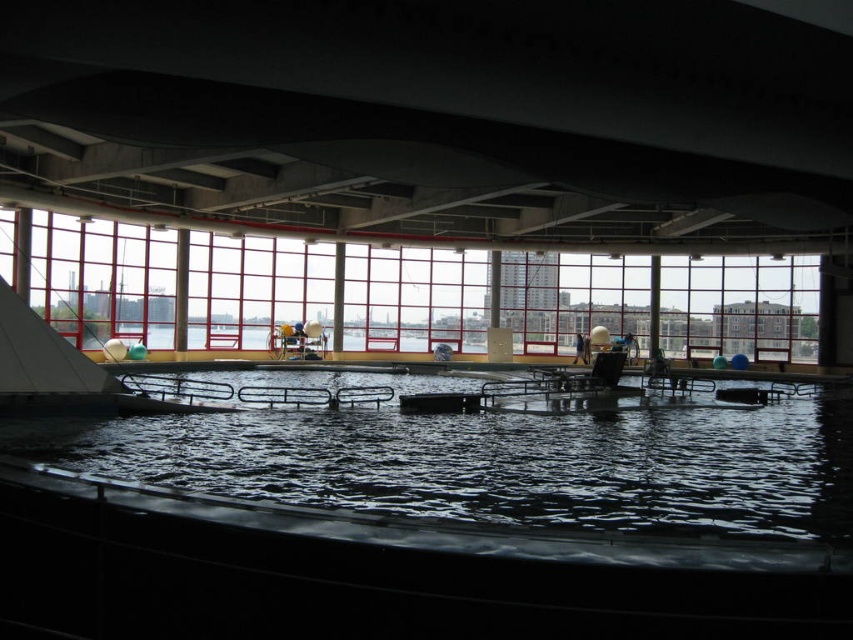
What is the exact coordinate of the clear plastic water at center in the image?

The clear plastic water at center is located at point (x=496, y=464).

You are a maintenance worker in the pool area. You need to move the light brown wooden chair at center closer to the clear plastic water at center. The safety regulation requires that the distance between them must be at least 10 feet. Is the current distance compliant with the regulation?

The distance between the clear plastic water at center and the light brown wooden chair at center is 56.94 feet, which is greater than the required 10 feet. Therefore, it complies with the safety regulation.